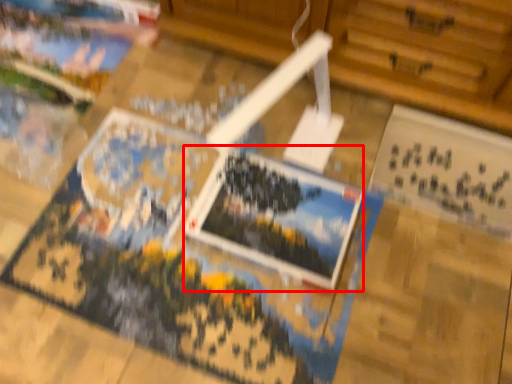
Question: Considering the relative positions of postcard (annotated by the red box) and postcard in the image provided, where is postcard (annotated by the red box) located with respect to the staircase?

Choices:
 (A) left
 (B) right

Answer: (A)